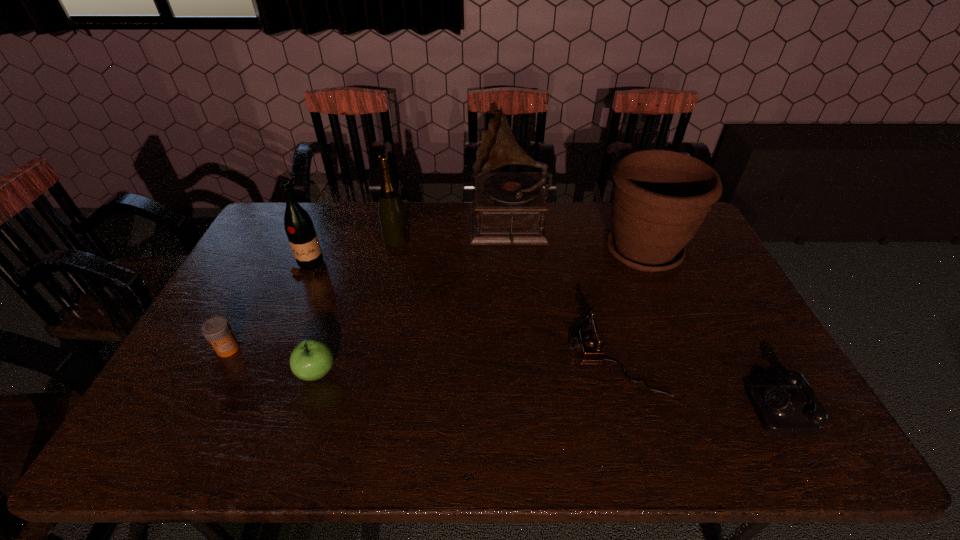
Image resolution: width=960 pixels, height=540 pixels. I want to click on record player, so click(x=509, y=207).

The height and width of the screenshot is (540, 960). I want to click on the fourth object from left to right, so click(392, 215).

Where is `the right wine bottle`? the right wine bottle is located at coordinates (392, 215).

Where is `flowerpot`? This screenshot has height=540, width=960. flowerpot is located at coordinates (660, 198).

Where is `the nearer wine bottle`? Image resolution: width=960 pixels, height=540 pixels. the nearer wine bottle is located at coordinates pos(298,224).

This screenshot has width=960, height=540. Identify the location of the seventh object from right to left. (298, 224).

The image size is (960, 540). What are the coordinates of `the left telephone` in the screenshot? It's located at (588, 343).

Identify the location of the third object from left to right. This screenshot has height=540, width=960. (311, 359).

Locate an element on the screen. The image size is (960, 540). the leftmost object is located at coordinates (217, 330).

The width and height of the screenshot is (960, 540). Find the location of `the shorter telephone`. the shorter telephone is located at coordinates (782, 409).